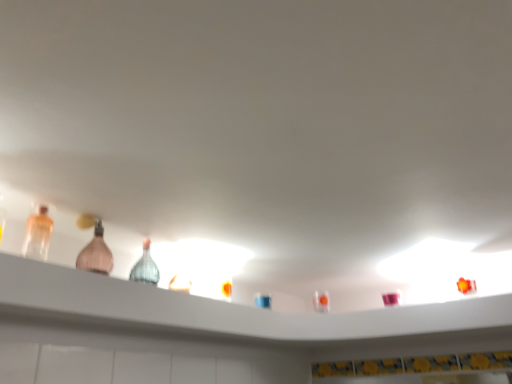
Question: Does point (323, 316) appear closer or farther from the camera than point (46, 223)?

Choices:
 (A) closer
 (B) farther

Answer: (B)

Question: Looking at their shapes, would you say translucent glass bottles at upper center is wider or thinner than translucent plastic bottle at left, which is counted as the second bottle, starting from the back?

Choices:
 (A) wide
 (B) thin

Answer: (A)

Question: Estimate the real-world distances between objects in this image. Which object is farther from the pink glass bottle at left, acting as the first bottle starting from the back?

Choices:
 (A) translucent plastic bottle at left, the 2th bottle in the right-to-left sequence
 (B) translucent glass bottles at upper center

Answer: (B)

Question: Which object is the farthest from the translucent glass bottles at upper center?

Choices:
 (A) translucent plastic bottle at left, the 1th bottle when ordered from left to right
 (B) pink glass bottle at left, which is the second bottle from front to back

Answer: (A)